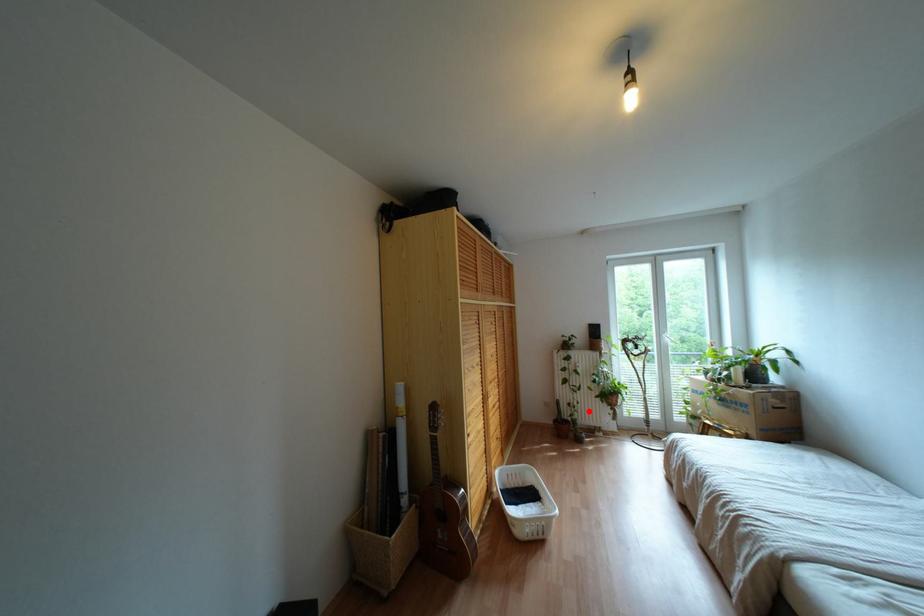
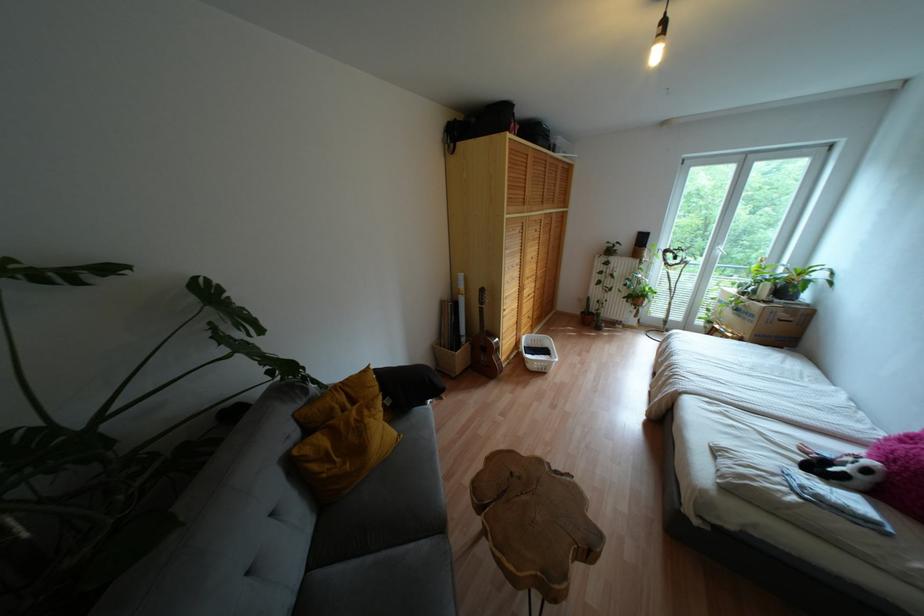
Locate, in the second image, the point that corresponds to the highlighted location in the first image.

(614, 309)